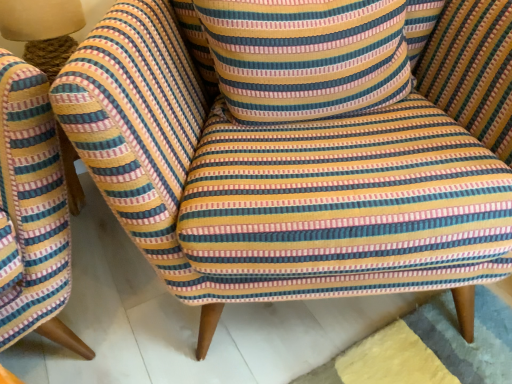
In order to face striped fabric pillow at center, should I rotate leftwards or rightwards?

You should rotate right by 7.358 degrees.

Image resolution: width=512 pixels, height=384 pixels. I want to click on striped fabric pillow at center, so click(306, 56).

This screenshot has width=512, height=384. What do you see at coordinates (306, 56) in the screenshot? I see `striped fabric pillow at center` at bounding box center [306, 56].

Locate an element on the screen. This screenshot has height=384, width=512. matte beige lampshade at upper left is located at coordinates (42, 30).

The height and width of the screenshot is (384, 512). What do you see at coordinates (42, 30) in the screenshot?
I see `matte beige lampshade at upper left` at bounding box center [42, 30].

I want to click on striped fabric pillow at center, so tap(306, 56).

Does striped fabric pillow at center appear on the left side of matte beige lampshade at upper left?

In fact, striped fabric pillow at center is to the right of matte beige lampshade at upper left.

Does striped fabric pillow at center lie in front of matte beige lampshade at upper left?

Yes, it is.

Which point is more forward, (234, 119) or (51, 6)?

The point (234, 119) is in front.

From the image's perspective, is striped fabric pillow at center below matte beige lampshade at upper left?

Yes, from the image's perspective, striped fabric pillow at center is beneath matte beige lampshade at upper left.

Consider the image. From a real-world perspective, which is physically below, striped fabric pillow at center or matte beige lampshade at upper left?

From a 3D spatial view, matte beige lampshade at upper left is below.

Between striped fabric pillow at center and matte beige lampshade at upper left, which one has smaller width?

matte beige lampshade at upper left is thinner.

Which of these two, striped fabric pillow at center or matte beige lampshade at upper left, stands taller?

With more height is striped fabric pillow at center.

Can you confirm if striped fabric pillow at center is bigger than matte beige lampshade at upper left?

Indeed, striped fabric pillow at center has a larger size compared to matte beige lampshade at upper left.

In the scene shown: Would you say striped fabric pillow at center is outside matte beige lampshade at upper left?

Absolutely, striped fabric pillow at center is external to matte beige lampshade at upper left.

Are striped fabric pillow at center and matte beige lampshade at upper left beside each other?

striped fabric pillow at center and matte beige lampshade at upper left are not in contact.

Is striped fabric pillow at center oriented towards matte beige lampshade at upper left?

No, striped fabric pillow at center is not oriented towards matte beige lampshade at upper left.

Identify the location of table lamp to the left of striped fabric pillow at center. (42, 30).

Considering the positions of objects matte beige lampshade at upper left and striped fabric pillow at center in the image provided, who is more to the left, matte beige lampshade at upper left or striped fabric pillow at center?

Positioned to the left is matte beige lampshade at upper left.

Considering their positions, is matte beige lampshade at upper left located in front of or behind striped fabric pillow at center?

Clearly, matte beige lampshade at upper left is behind striped fabric pillow at center.

Does point (79, 12) lie behind point (258, 2)?

Yes, point (79, 12) is farther from viewer.

From the image's perspective, is matte beige lampshade at upper left located above or below striped fabric pillow at center?

matte beige lampshade at upper left is situated higher than striped fabric pillow at center in the image.

From a real-world perspective, is matte beige lampshade at upper left over striped fabric pillow at center?

No, from a real-world perspective, matte beige lampshade at upper left is not on top of striped fabric pillow at center.

Considering the relative sizes of matte beige lampshade at upper left and striped fabric pillow at center in the image provided, is matte beige lampshade at upper left thinner than striped fabric pillow at center?

Indeed, matte beige lampshade at upper left has a lesser width compared to striped fabric pillow at center.

In terms of height, does matte beige lampshade at upper left look taller or shorter compared to striped fabric pillow at center?

In the image, matte beige lampshade at upper left appears to be shorter than striped fabric pillow at center.

Considering the relative sizes of matte beige lampshade at upper left and striped fabric pillow at center in the image provided, is matte beige lampshade at upper left smaller than striped fabric pillow at center?

Yes, matte beige lampshade at upper left is smaller than striped fabric pillow at center.

Is matte beige lampshade at upper left outside of striped fabric pillow at center?

Yes, matte beige lampshade at upper left is outside of striped fabric pillow at center.

Are matte beige lampshade at upper left and striped fabric pillow at center far apart?

No, matte beige lampshade at upper left is in close proximity to striped fabric pillow at center.

Is matte beige lampshade at upper left facing towards striped fabric pillow at center?

No, matte beige lampshade at upper left is not turned towards striped fabric pillow at center.

What's the angular difference between matte beige lampshade at upper left and striped fabric pillow at center's facing directions?

The facing directions of matte beige lampshade at upper left and striped fabric pillow at center are 8.79 degrees apart.

You are a GUI agent. You are given a task and a screenshot of the screen. Output one action in this format:
    pyautogui.click(x=<x>, y=<y>)
    Task: Click on the throw pillow on the right of matte beige lampshade at upper left
    
    Given the screenshot: What is the action you would take?
    pyautogui.click(x=306, y=56)

At what (x,y) coordinates should I click in order to perform the action: click on throw pillow on the right side of matte beige lampshade at upper left. Please return your answer as a coordinate pair (x, y). Looking at the image, I should click on (306, 56).

Find the location of `throw pillow in front of the matte beige lampshade at upper left`. throw pillow in front of the matte beige lampshade at upper left is located at coordinates (306, 56).